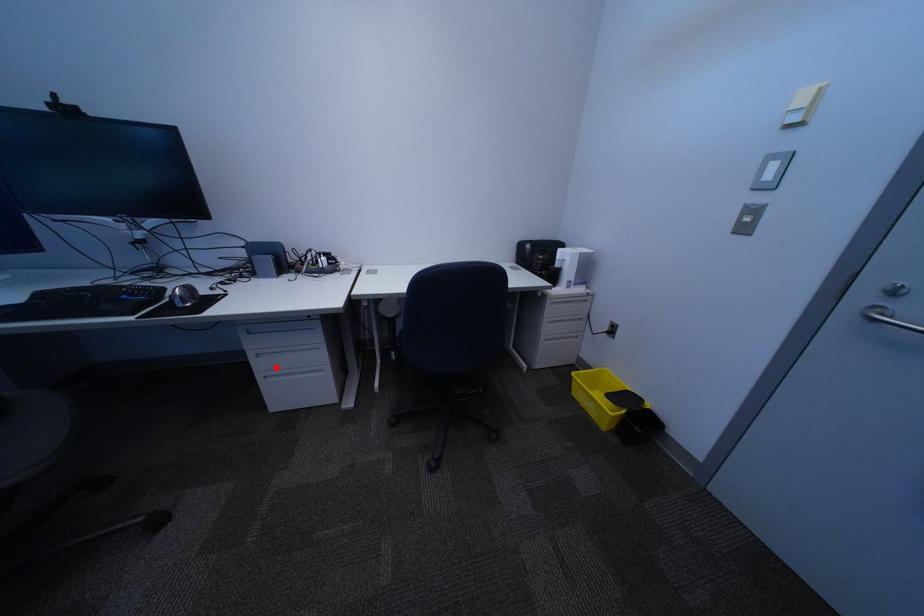
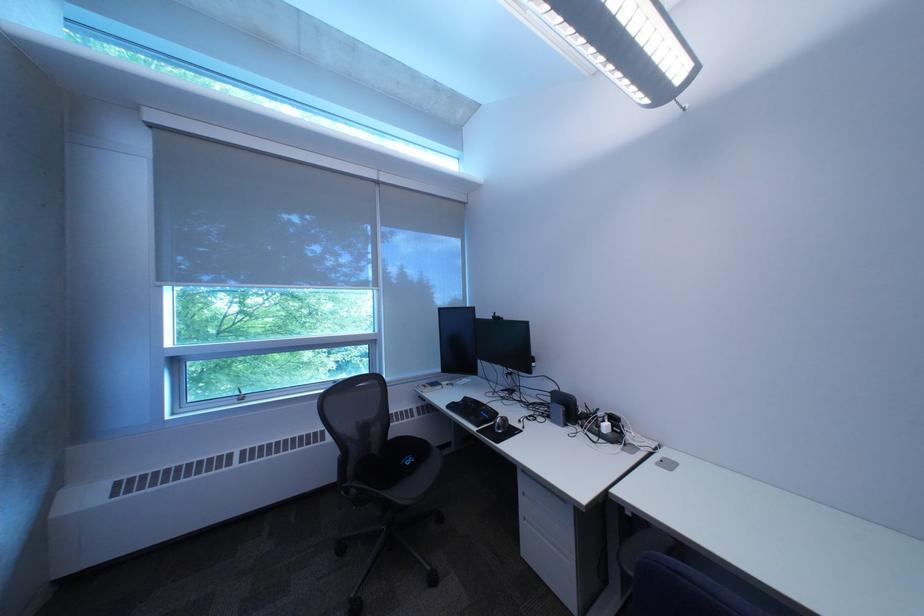
Locate, in the second image, the point that corresponds to the highlighted location in the first image.

(541, 506)